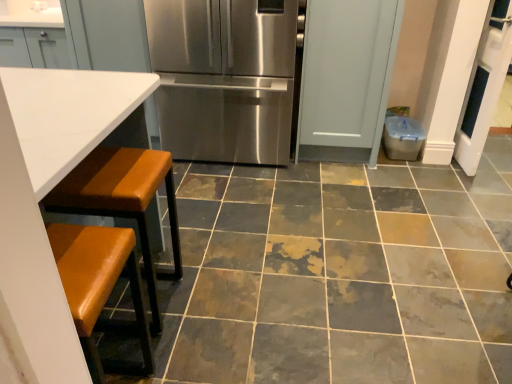
Identify the location of stainless steel refrigerator at center. (x=224, y=78).

This screenshot has height=384, width=512. I want to click on white leather table at left, so click(x=49, y=191).

Describe the element at coordinates (123, 200) in the screenshot. The image size is (512, 384). I see `brown leather stool at lower left` at that location.

You are a GUI agent. You are given a task and a screenshot of the screen. Output one action in this format:
    pyautogui.click(x=<x>, y=<y>)
    Task: Click on the stainless steel refrigerator at center
    The image size is (512, 384).
    Given the screenshot: What is the action you would take?
    pyautogui.click(x=224, y=78)

Can we say marble-like ceramic tile at center lies outside stainless steel refrigerator at center?

Yes.

Between marble-like ceramic tile at center and stainless steel refrigerator at center, which one appears on the left side from the viewer's perspective?

From the viewer's perspective, stainless steel refrigerator at center appears more on the left side.

Locate an element on the screen. Image resolution: width=512 pixels, height=384 pixels. ceramic tile below the stainless steel refrigerator at center (from the image's perspective) is located at coordinates point(341,275).

Does marble-like ceramic tile at center touch stainless steel refrigerator at center?

There is a gap between marble-like ceramic tile at center and stainless steel refrigerator at center.

Considering the positions of objects marble-like ceramic tile at center and white leather table at left in the image provided, who is behind, marble-like ceramic tile at center or white leather table at left?

marble-like ceramic tile at center is further from the camera.

From their relative heights in the image, would you say marble-like ceramic tile at center is taller or shorter than white leather table at left?

Clearly, marble-like ceramic tile at center is shorter compared to white leather table at left.

Is marble-like ceramic tile at center inside or outside of white leather table at left?

marble-like ceramic tile at center is outside white leather table at left.

How much distance is there between marble-like ceramic tile at center and white leather table at left?

marble-like ceramic tile at center is 3.92 feet away from white leather table at left.

Between stainless steel refrigerator at center and marble-like ceramic tile at center, which one has smaller width?

Thinner between the two is stainless steel refrigerator at center.

From the picture: Does stainless steel refrigerator at center have a greater height compared to marble-like ceramic tile at center?

Yes, stainless steel refrigerator at center is taller than marble-like ceramic tile at center.

How far apart are stainless steel refrigerator at center and marble-like ceramic tile at center?

They are 35.90 inches apart.

Based on the photo, is stainless steel refrigerator at center spatially inside marble-like ceramic tile at center, or outside of it?

stainless steel refrigerator at center is spatially situated outside marble-like ceramic tile at center.

Could you tell me if white leather table at left is turned towards stainless steel refrigerator at center?

Yes, white leather table at left is facing stainless steel refrigerator at center.

Who is smaller, white leather table at left or stainless steel refrigerator at center?

Smaller between the two is white leather table at left.

Does point (28, 268) lie in front of point (163, 134)?

Yes, point (28, 268) is closer to viewer.

Based on the photo, considering the relative positions of white leather table at left and stainless steel refrigerator at center in the image provided, is white leather table at left to the left or to the right of stainless steel refrigerator at center?

In the image, white leather table at left appears on the left side of stainless steel refrigerator at center.

Based on the photo, from a real-world perspective, between brown leather stool at lower left and stainless steel refrigerator at center, who is vertically lower?

brown leather stool at lower left.

In terms of height, does brown leather stool at lower left look taller or shorter compared to stainless steel refrigerator at center?

Clearly, brown leather stool at lower left is shorter compared to stainless steel refrigerator at center.

In the image, is brown leather stool at lower left on the left side or the right side of stainless steel refrigerator at center?

Clearly, brown leather stool at lower left is on the left of stainless steel refrigerator at center in the image.

Is brown leather stool at lower left oriented towards stainless steel refrigerator at center?

No, brown leather stool at lower left does not turn towards stainless steel refrigerator at center.

In the scene shown: How different are the orientations of marble-like ceramic tile at center and brown leather stool at lower left in degrees?

The facing directions of marble-like ceramic tile at center and brown leather stool at lower left are 0.52 degrees apart.

Considering the positions of objects marble-like ceramic tile at center and brown leather stool at lower left in the image provided, who is behind, marble-like ceramic tile at center or brown leather stool at lower left?

marble-like ceramic tile at center is more distant.

The image size is (512, 384). What are the coordinates of `step stool below the marble-like ceramic tile at center (from the image's perspective)` in the screenshot? It's located at (123, 200).

Would you consider marble-like ceramic tile at center to be distant from brown leather stool at lower left?

Actually, marble-like ceramic tile at center and brown leather stool at lower left are a little close together.

Would you consider brown leather stool at lower left to be distant from marble-like ceramic tile at center?

brown leather stool at lower left is actually quite close to marble-like ceramic tile at center.

Image resolution: width=512 pixels, height=384 pixels. Identify the location of step stool in front of the marble-like ceramic tile at center. (123, 200).

Which is more to the right, brown leather stool at lower left or marble-like ceramic tile at center?

marble-like ceramic tile at center is more to the right.

Locate an element on the screen. This screenshot has height=384, width=512. refrigerator on the left of marble-like ceramic tile at center is located at coordinates (224, 78).

The image size is (512, 384). I want to click on table in front of the marble-like ceramic tile at center, so click(49, 191).

In the scene shown: From the image, which object appears to be farther from marble-like ceramic tile at center, brown leather stool at lower left or stainless steel refrigerator at center?

Based on the image, stainless steel refrigerator at center appears to be further to marble-like ceramic tile at center.

Estimate the real-world distances between objects in this image. Which object is further from brown leather stool at lower left, marble-like ceramic tile at center or white leather table at left?

The object further to brown leather stool at lower left is marble-like ceramic tile at center.

When comparing their distances from white leather table at left, does marble-like ceramic tile at center or stainless steel refrigerator at center seem further?

Among the two, marble-like ceramic tile at center is located further to white leather table at left.

Considering their positions, is white leather table at left positioned closer to marble-like ceramic tile at center than brown leather stool at lower left?

brown leather stool at lower left is positioned closer to the anchor marble-like ceramic tile at center.

Based on their spatial positions, is marble-like ceramic tile at center or white leather table at left closer to stainless steel refrigerator at center?

marble-like ceramic tile at center.

Based on their spatial positions, is white leather table at left or brown leather stool at lower left closer to stainless steel refrigerator at center?

brown leather stool at lower left is positioned closer to the anchor stainless steel refrigerator at center.

Based on their spatial positions, is marble-like ceramic tile at center or brown leather stool at lower left closer to white leather table at left?

Among the two, brown leather stool at lower left is located nearer to white leather table at left.

Estimate the real-world distances between objects in this image. Which object is further from marble-like ceramic tile at center, stainless steel refrigerator at center or white leather table at left?

Among the two, white leather table at left is located further to marble-like ceramic tile at center.

Locate an element on the screen. Image resolution: width=512 pixels, height=384 pixels. ceramic tile between stainless steel refrigerator at center and brown leather stool at lower left in the up-down direction is located at coordinates (341, 275).

Identify the location of step stool situated between white leather table at left and marble-like ceramic tile at center from left to right. Image resolution: width=512 pixels, height=384 pixels. (123, 200).

The image size is (512, 384). Identify the location of step stool between white leather table at left and stainless steel refrigerator at center along the z-axis. (123, 200).

At what (x,y) coordinates should I click in order to perform the action: click on ceramic tile between white leather table at left and stainless steel refrigerator at center in the front-back direction. Please return your answer as a coordinate pair (x, y). The image size is (512, 384). Looking at the image, I should click on (341, 275).